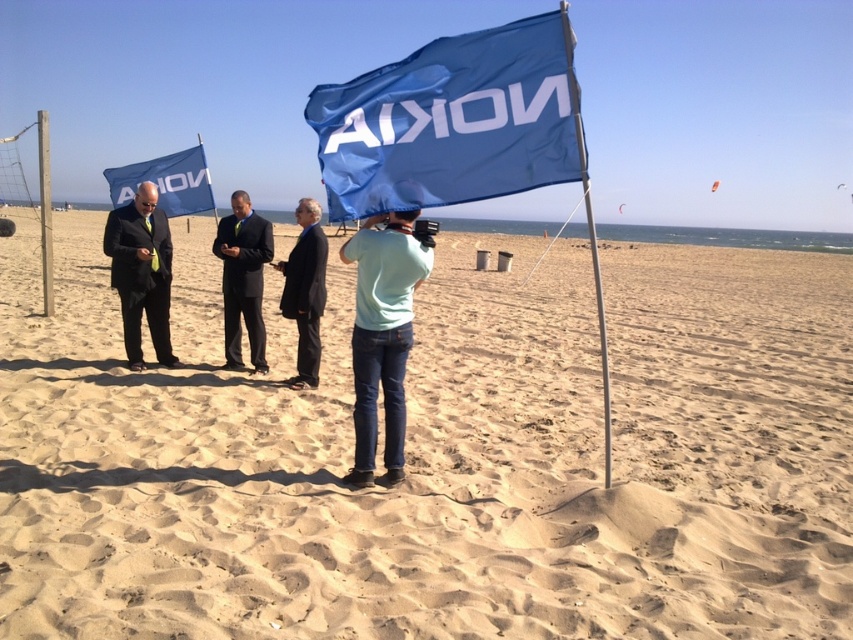
You are a photographer at the beach scene. You need to position a tripod so it is between the sandy beach at center and the light blue cotton shirt at center. Is this possible?

The sandy beach at center is located above the light blue cotton shirt at center, so placing the tripod between them would require positioning it in the space between the beach area and the shirt, which is vertically aligned. Since the beach is above the shirt, the tripod can be placed between them along the vertical axis.

What is the location of the point with coordinates (x=439, y=456) in the image?

The point with coordinates (x=439, y=456) corresponds to the sandy beach at center.